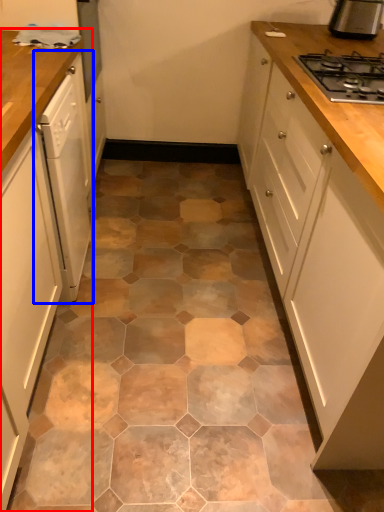
Question: Which of the following is the farthest to the observer, cabinetry (highlighted by a red box) or home appliance (highlighted by a blue box)?

Choices:
 (A) cabinetry
 (B) home appliance

Answer: (B)